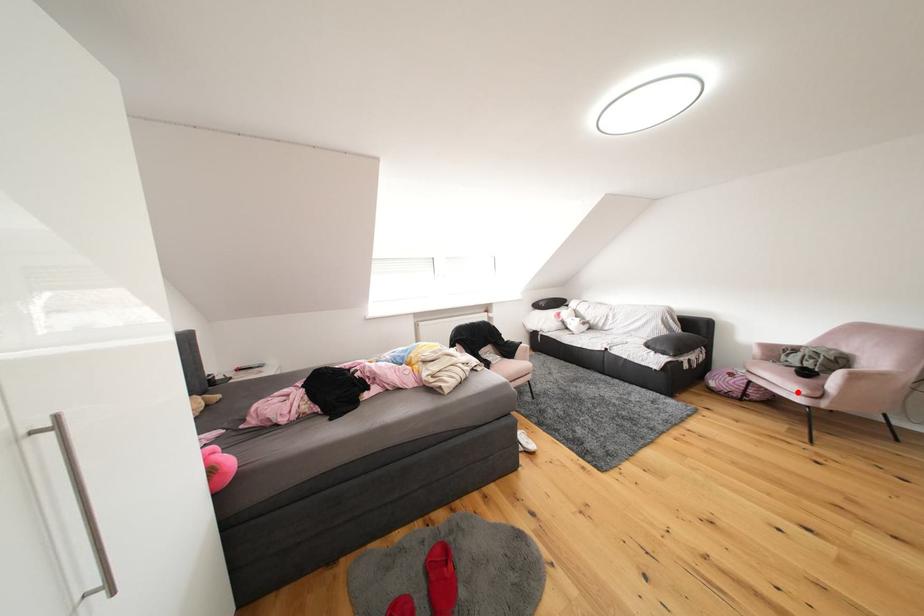
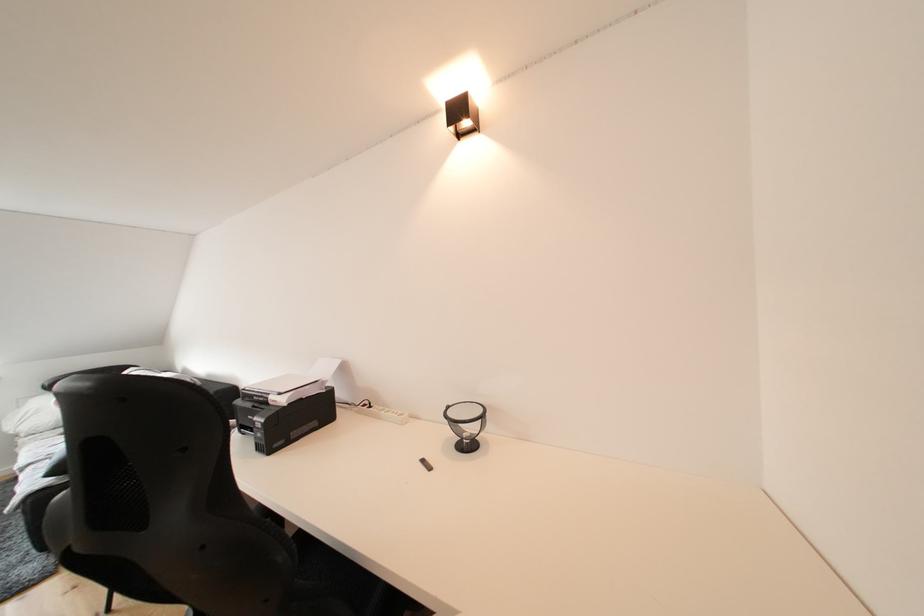
Question: I am providing you with two images of the same scene from different viewpoints. A red point is marked on the first image. Is the red point's position out of view in image 2?

Choices:
 (A) Yes
 (B) No

Answer: (A)